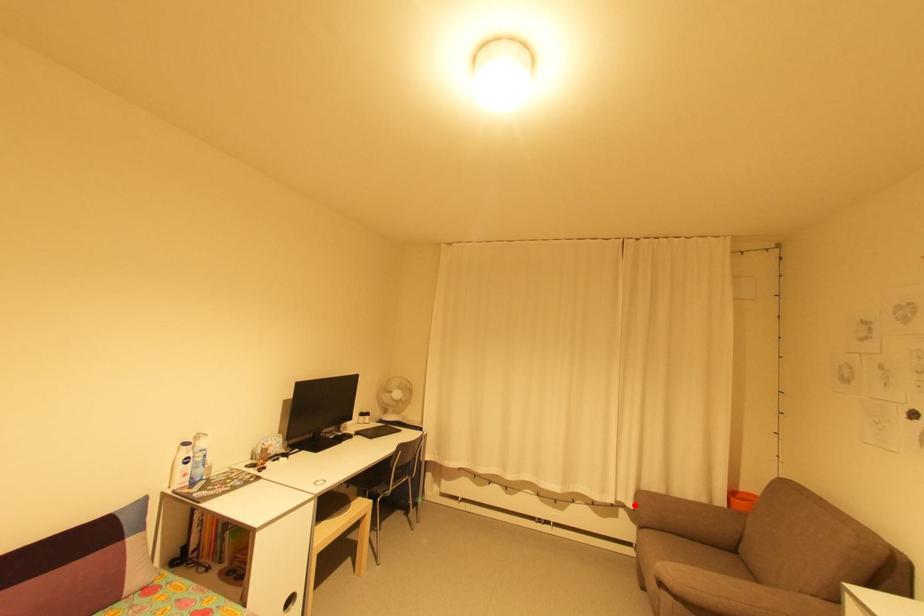
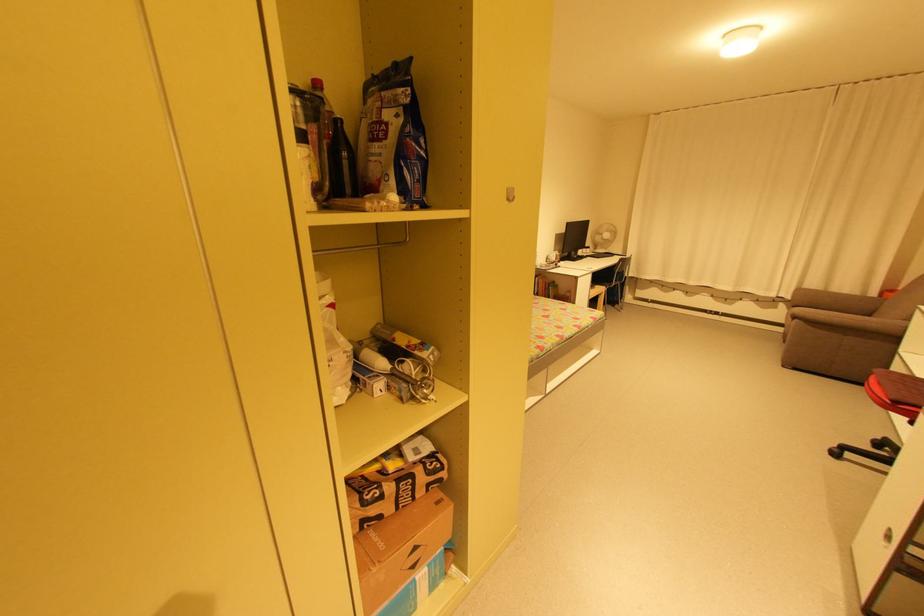
The point at the highlighted location is marked in the first image. Where is the corresponding point in the second image?

(794, 297)